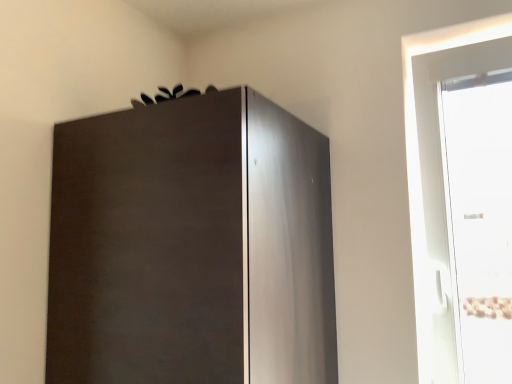
What is the approximate width of matte dark wood cupboard at upper left?

The width of matte dark wood cupboard at upper left is 24.29 inches.

This screenshot has width=512, height=384. What do you see at coordinates (191, 246) in the screenshot?
I see `matte dark wood cupboard at upper left` at bounding box center [191, 246].

Locate an element on the screen. The height and width of the screenshot is (384, 512). matte dark wood cupboard at upper left is located at coordinates (191, 246).

The image size is (512, 384). I want to click on matte dark wood cupboard at upper left, so click(x=191, y=246).